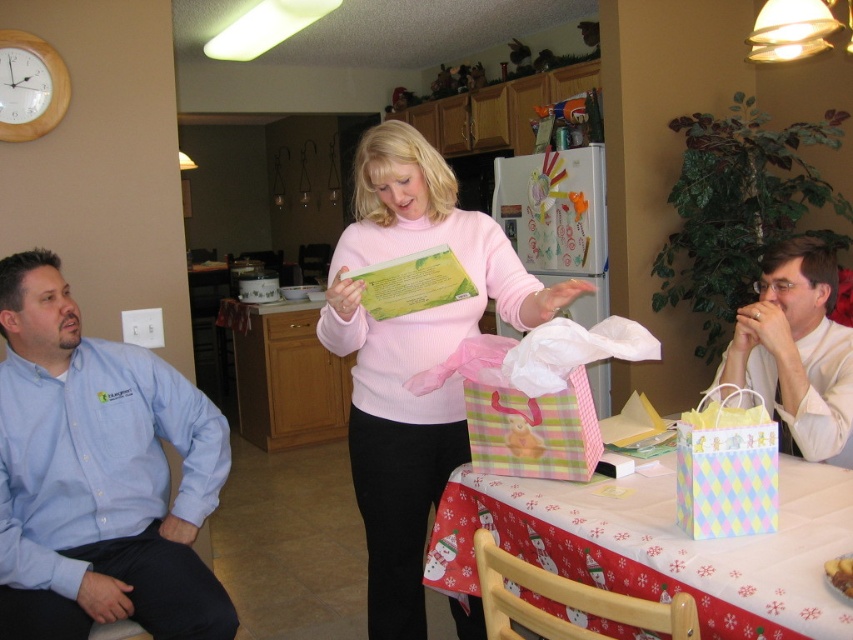
Does pastel diamond-patterned gift bag at lower center have a lesser width compared to pastel diamond-patterned gift bag at lower right?

Incorrect, pastel diamond-patterned gift bag at lower center's width is not less than pastel diamond-patterned gift bag at lower right's.

Between pastel diamond-patterned gift bag at lower center and pastel diamond-patterned gift bag at lower right, which one has more height?

pastel diamond-patterned gift bag at lower center

Between point (428, 573) and point (724, 465), which one is positioned in front?

Point (724, 465)

You are a GUI agent. You are given a task and a screenshot of the screen. Output one action in this format:
    pyautogui.click(x=<x>, y=<y>)
    Task: Click on the pastel diamond-patterned gift bag at lower center
    The width and height of the screenshot is (853, 640).
    Given the screenshot: What is the action you would take?
    pyautogui.click(x=660, y=547)

Does pink ribbed sweater at center appear over pastel diamond-patterned gift bag at lower center?

Correct, pink ribbed sweater at center is located above pastel diamond-patterned gift bag at lower center.

Can you confirm if pink ribbed sweater at center is positioned below pastel diamond-patterned gift bag at lower center?

No.

This screenshot has width=853, height=640. I want to click on pink ribbed sweater at center, so click(x=413, y=355).

Is point (212, 429) closer to camera compared to point (802, 628)?

No, it is not.

Who is more forward, (x=183, y=492) or (x=677, y=582)?

Point (x=677, y=582) is more forward.

The image size is (853, 640). I want to click on blue cotton shirt at left, so click(97, 476).